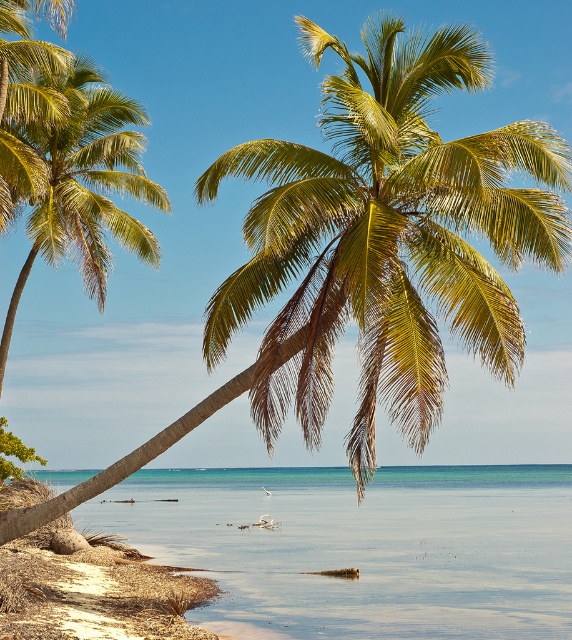
Question: Does clear blue water at center appear on the right side of green leafy palm tree at left?

Choices:
 (A) yes
 (B) no

Answer: (A)

Question: Is clear blue water at center smaller than green leafy palm tree at left?

Choices:
 (A) no
 (B) yes

Answer: (A)

Question: Which point is closer to the camera?

Choices:
 (A) tap(416, 634)
 (B) tap(100, 120)

Answer: (A)

Question: Is clear blue water at center to the right of green leafy palm tree at left from the viewer's perspective?

Choices:
 (A) no
 (B) yes

Answer: (B)

Question: Which point is closer to the camera?

Choices:
 (A) green leafy palm tree at left
 (B) clear blue water at center

Answer: (B)

Question: Which of the following is the closest to the observer?

Choices:
 (A) (403, 541)
 (B) (96, 100)

Answer: (B)